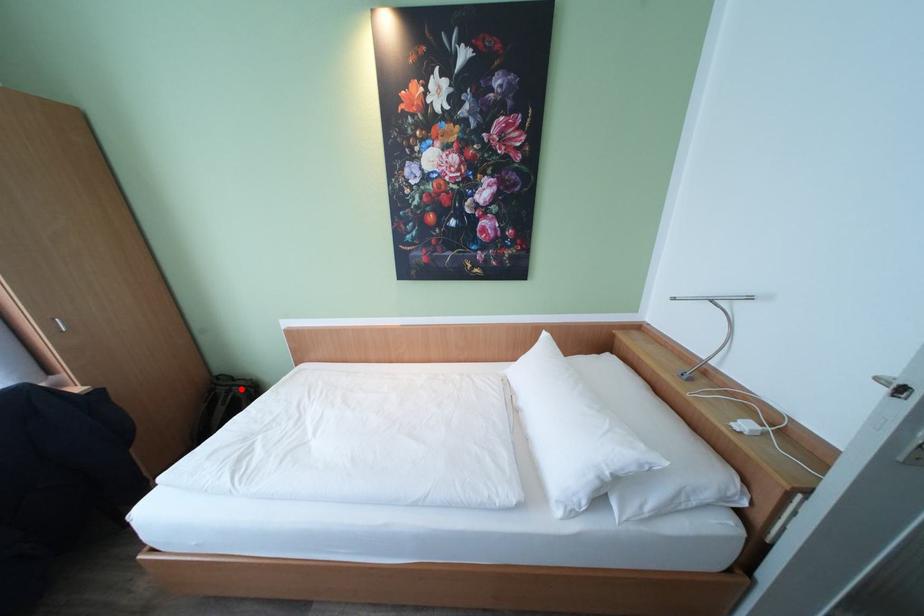
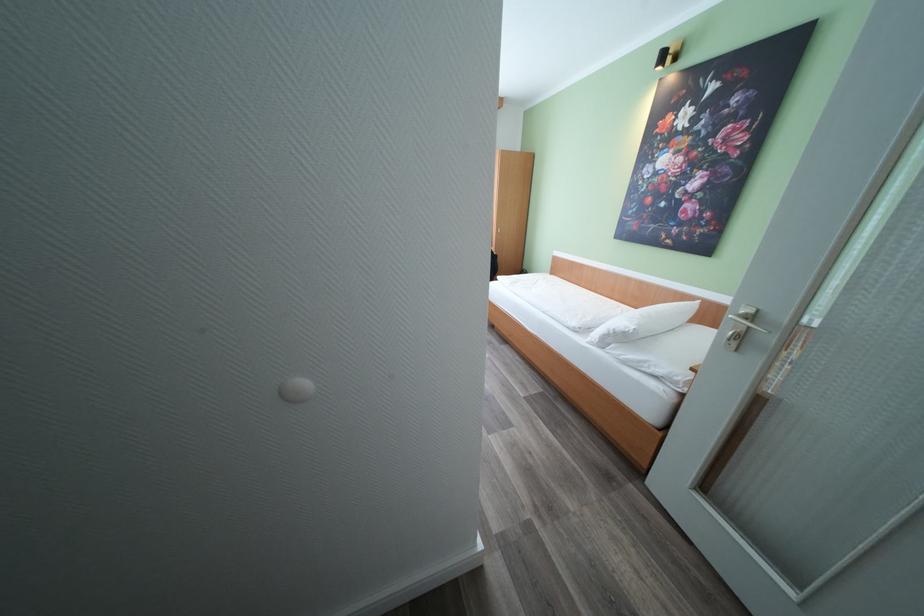
Question: I am providing you with two images of the same scene from different viewpoints. A red point is marked on the first image. Is the red point's position out of view in image 2?

Choices:
 (A) Yes
 (B) No

Answer: (A)